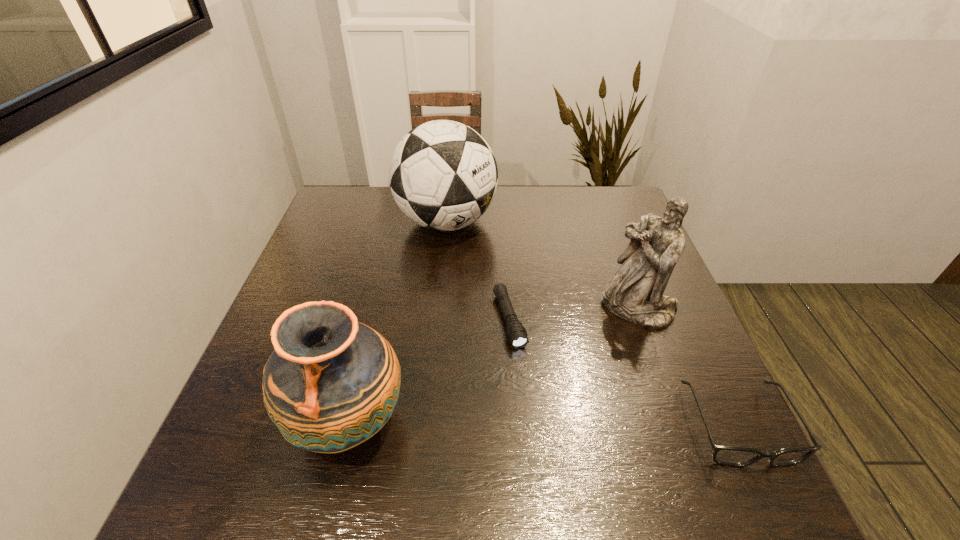
The image size is (960, 540). Identify the location of vacant area that satisfies the following two spatial constraints: 1. on the front side of the farthest object; 2. on the left side of the flashlight. (437, 321).